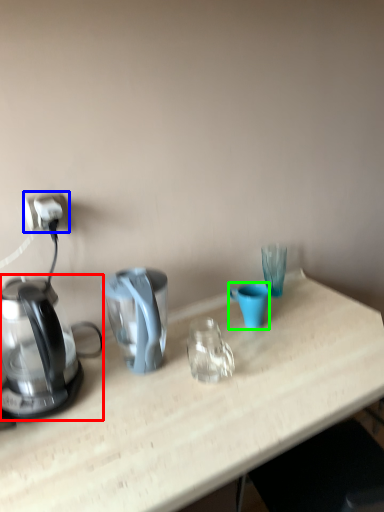
Question: Which object is positioned farthest from kettle (highlighted by a red box)? Select from power outlet (highlighted by a blue box) and coffee cup (highlighted by a green box).

Choices:
 (A) power outlet
 (B) coffee cup

Answer: (B)